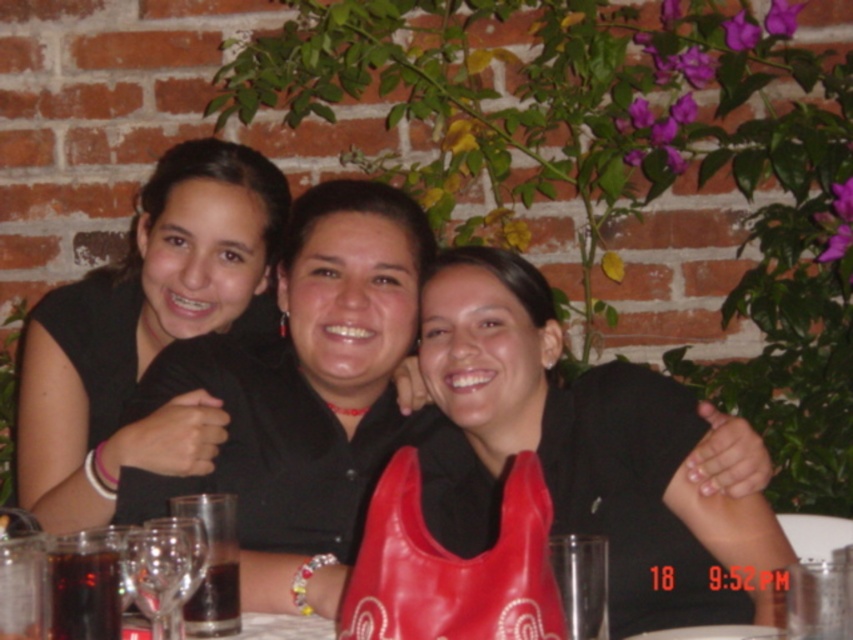
You are a photographer at the event and need to ensure that the black matte shirt at center and the transparent glass wine glass at center are both clearly visible in the photo. Given their sizes, which object might require more careful framing to avoid being too small in the image?

The transparent glass wine glass at center is smaller in size compared to the black matte shirt at center, so it might require more careful framing to ensure it is not too small in the image.

You are trying to decide which of the two black shirts to wear for an event. Both the matte black shirt at center and the black matte shirt at center are options. Based on the image, which one has a wider fit?

The matte black shirt at center is wider than the black matte shirt at center, so it would be the better choice for a wider fit.